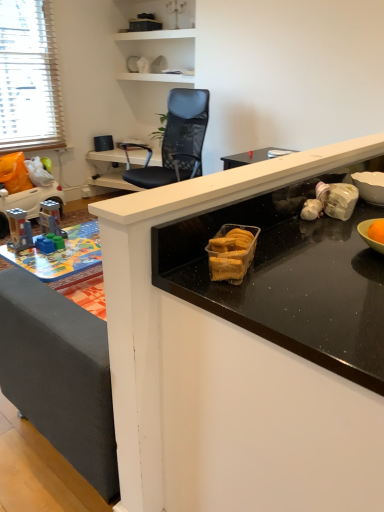
Question: Is black mesh chair at upper center in front of or behind plastic toy car at left, positioned as the second toy in front-to-back order, in the image?

Choices:
 (A) front
 (B) behind

Answer: (B)

Question: In terms of size, does black mesh chair at upper center appear bigger or smaller than plastic toy car at left, positioned as the second toy in front-to-back order?

Choices:
 (A) small
 (B) big

Answer: (A)

Question: Estimate the real-world distances between objects in this image. Which object is farther from the black mesh chair at upper center?

Choices:
 (A) black glossy countertop at center
 (B) black mesh chair at upper center
 (C) plastic toy car at left, which is the second toy from bottom to top
 (D) plastic building blocks at lower left, which is the first toy from front to back

Answer: (A)

Question: Which object is positioned closest to the black mesh chair at upper center?

Choices:
 (A) plastic toy car at left, the second toy when ordered from right to left
 (B) black mesh chair at upper center
 (C) black glossy countertop at center
 (D) plastic building blocks at lower left, the first toy in the right-to-left sequence

Answer: (B)